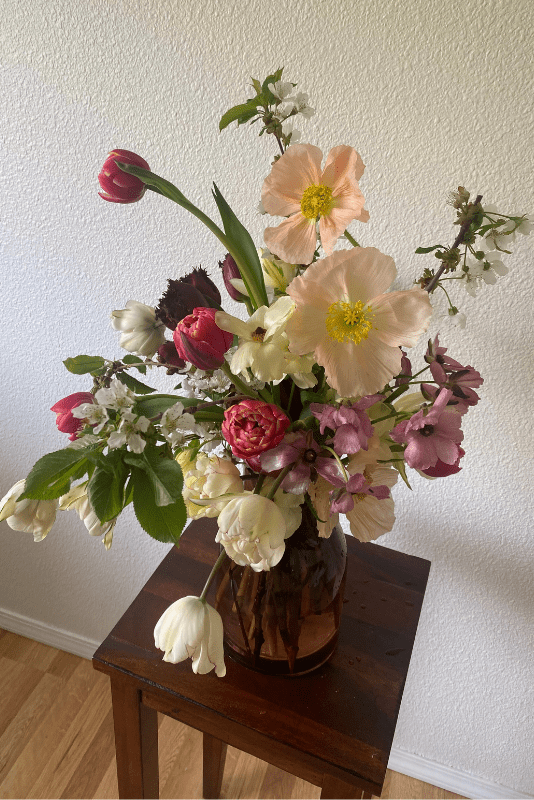
Locate an element on the screen. The height and width of the screenshot is (800, 534). white trim is located at coordinates (25, 626), (73, 644), (409, 762), (451, 777), (488, 790).